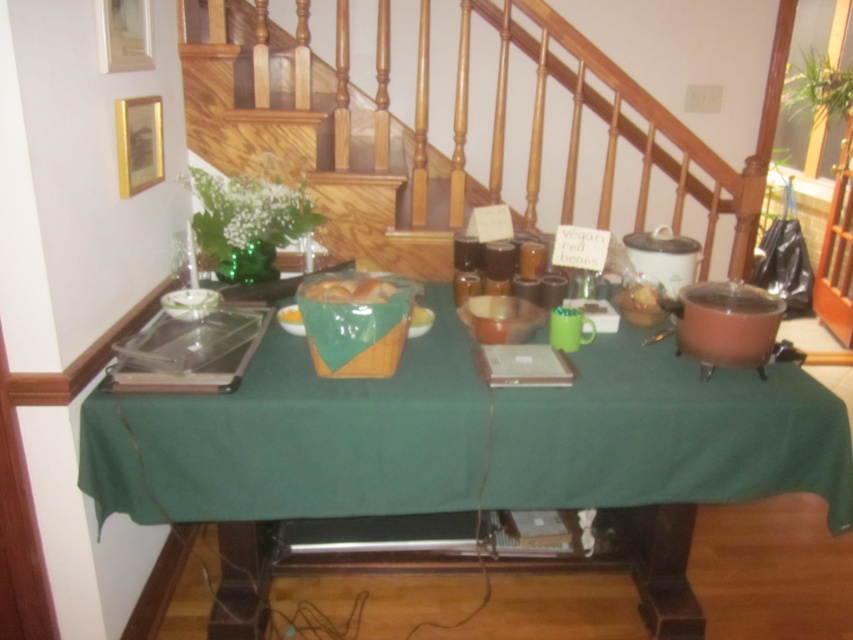
You are standing in the room and see the green fabric table at center and the yellow matte bread at center. Which object is positioned to the right when viewed from your perspective?

The green fabric table at center is to the right of the yellow matte bread at center.

You are trying to place a small decorative item on the highest point between the green fabric table at center and the wooden stairs at center. Which one should you choose?

The wooden stairs at center is taller than the green fabric table at center, so you should place the decorative item on the wooden stairs at center.